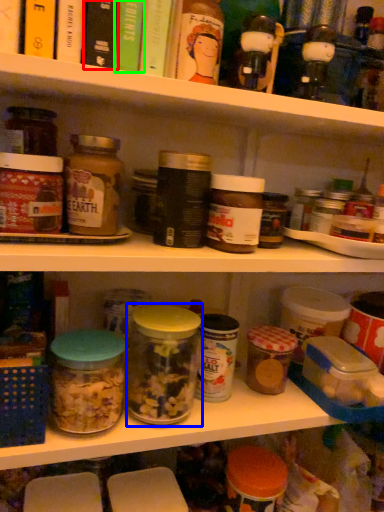
Question: Which is farther away from book (highlighted by a red box)? glass jar (highlighted by a blue box) or book (highlighted by a green box)?

Choices:
 (A) glass jar
 (B) book

Answer: (A)